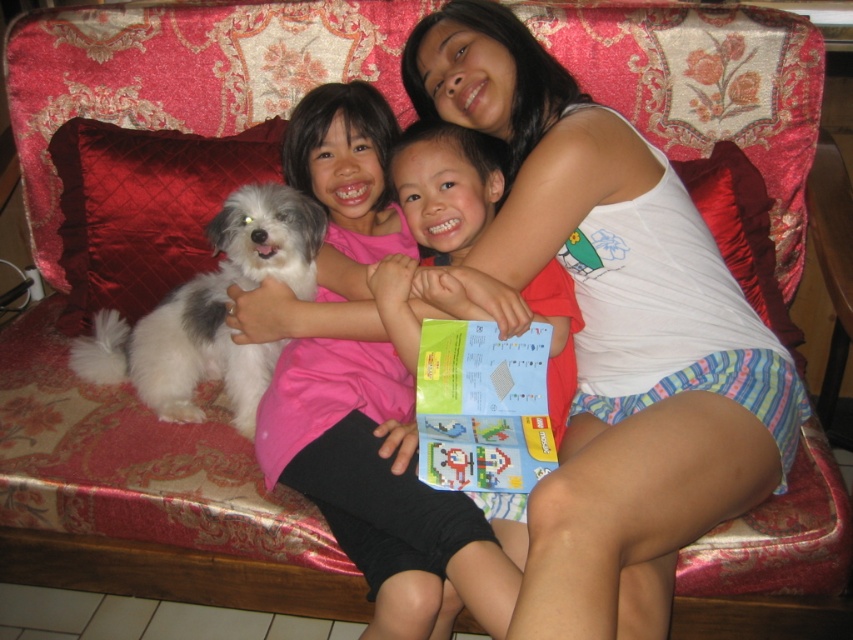
Question: Among these points, which one is farthest from the camera?

Choices:
 (A) (288, 227)
 (B) (561, 484)

Answer: (A)

Question: Can you confirm if velvet red pillow at left is thinner than red satin pillow at upper right?

Choices:
 (A) no
 (B) yes

Answer: (A)

Question: Can you confirm if white cotton tank top at upper center is positioned to the right of pink fabric at center?

Choices:
 (A) yes
 (B) no

Answer: (A)

Question: Can you confirm if white cotton tank top at upper center is positioned to the left of red satin pillow at upper right?

Choices:
 (A) no
 (B) yes

Answer: (B)

Question: Which point appears farthest from the camera in this image?

Choices:
 (A) (762, 250)
 (B) (564, 586)
 (C) (383, 380)
 (D) (61, 209)

Answer: (D)

Question: Estimate the real-world distances between objects in this image. Which object is farther from the white cotton tank top at upper center?

Choices:
 (A) red satin pillow at upper right
 (B) velvet red pillow at left

Answer: (B)